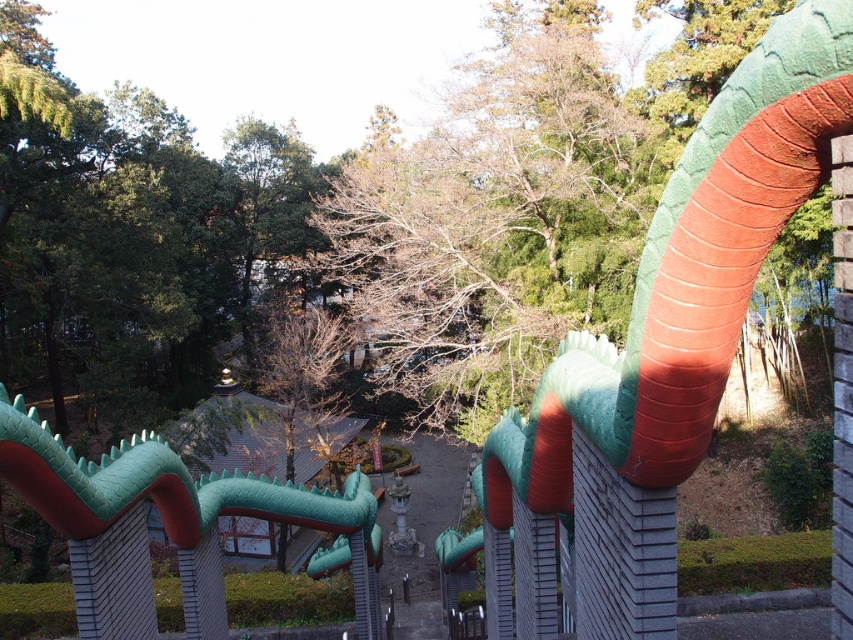
Question: Considering the relative positions of green matte snake at upper center and green matte dragon at center in the image provided, where is green matte snake at upper center located with respect to green matte dragon at center?

Choices:
 (A) below
 (B) above

Answer: (B)

Question: Is green matte snake at upper center to the right of green matte dragon at center from the viewer's perspective?

Choices:
 (A) yes
 (B) no

Answer: (A)

Question: Does green matte snake at upper center appear over green matte dragon at center?

Choices:
 (A) no
 (B) yes

Answer: (B)